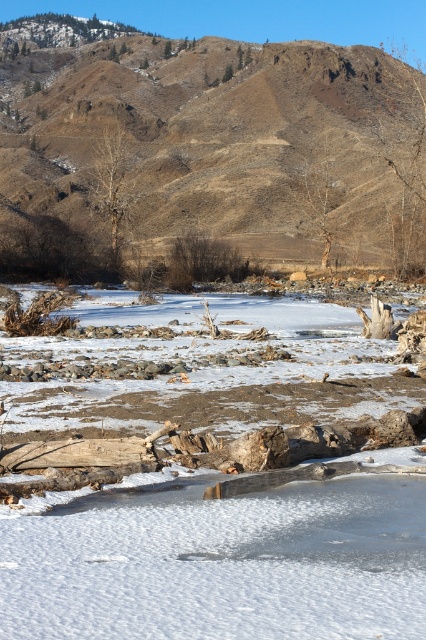
Question: Which object is farther from the camera taking this photo?

Choices:
 (A) brown/dry soil at upper center
 (B) white matte snow at center

Answer: (A)

Question: Is white matte snow at center above brown/dry soil at upper center?

Choices:
 (A) no
 (B) yes

Answer: (A)

Question: Is white matte snow at center smaller than brown/dry soil at upper center?

Choices:
 (A) yes
 (B) no

Answer: (A)

Question: Can you confirm if white matte snow at center is positioned above brown/dry soil at upper center?

Choices:
 (A) no
 (B) yes

Answer: (A)